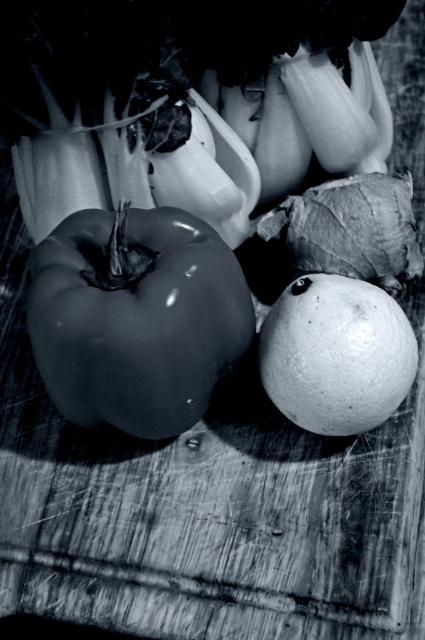
What is located at the point with coordinates (136, 317)?

The point with coordinates (136, 317) indicates the location of the glossy black pepper at left.

You are a chef preparing a dish and need to reach for both the glossy black pepper at left and the smooth white orange at center. Which one would you grab first if you want to pick up the one closer to you?

The glossy black pepper at left is closer to the viewer than the smooth white orange at center, so you should grab the glossy black pepper at left first.

You are arranging spices on a shelf and need to know the relative heights of the glossy black pepper at left and the smooth white orange at center. Which one is taller?

The glossy black pepper at left is taller than the smooth white orange at center.